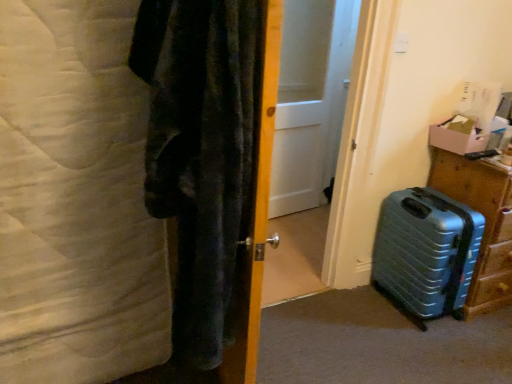
Question: Is white soft blanket at left positioned with its back to metallic blue suitcase at lower right?

Choices:
 (A) yes
 (B) no

Answer: (B)

Question: From the image's perspective, does white soft blanket at left appear lower than metallic blue suitcase at lower right?

Choices:
 (A) no
 (B) yes

Answer: (A)

Question: Is white soft blanket at left beside metallic blue suitcase at lower right?

Choices:
 (A) no
 (B) yes

Answer: (A)

Question: From a real-world perspective, is white soft blanket at left located beneath metallic blue suitcase at lower right?

Choices:
 (A) no
 (B) yes

Answer: (A)

Question: From a real-world perspective, is white soft blanket at left on metallic blue suitcase at lower right?

Choices:
 (A) no
 (B) yes

Answer: (B)

Question: Considering the relative sizes of white soft blanket at left and metallic blue suitcase at lower right in the image provided, is white soft blanket at left smaller than metallic blue suitcase at lower right?

Choices:
 (A) yes
 (B) no

Answer: (B)

Question: From the image's perspective, is metallic blue suitcase at lower right on wooden door at center?

Choices:
 (A) no
 (B) yes

Answer: (A)

Question: Does metallic blue suitcase at lower right come behind wooden door at center?

Choices:
 (A) no
 (B) yes

Answer: (B)

Question: Can you confirm if metallic blue suitcase at lower right is shorter than wooden door at center?

Choices:
 (A) no
 (B) yes

Answer: (B)

Question: Does metallic blue suitcase at lower right appear on the right side of wooden door at center?

Choices:
 (A) yes
 (B) no

Answer: (A)

Question: Is metallic blue suitcase at lower right completely or partially outside of wooden door at center?

Choices:
 (A) yes
 (B) no

Answer: (A)

Question: Is metallic blue suitcase at lower right facing away from wooden door at center?

Choices:
 (A) no
 (B) yes

Answer: (A)

Question: Could wooden door at center be considered to be inside white matte door at center?

Choices:
 (A) yes
 (B) no

Answer: (B)